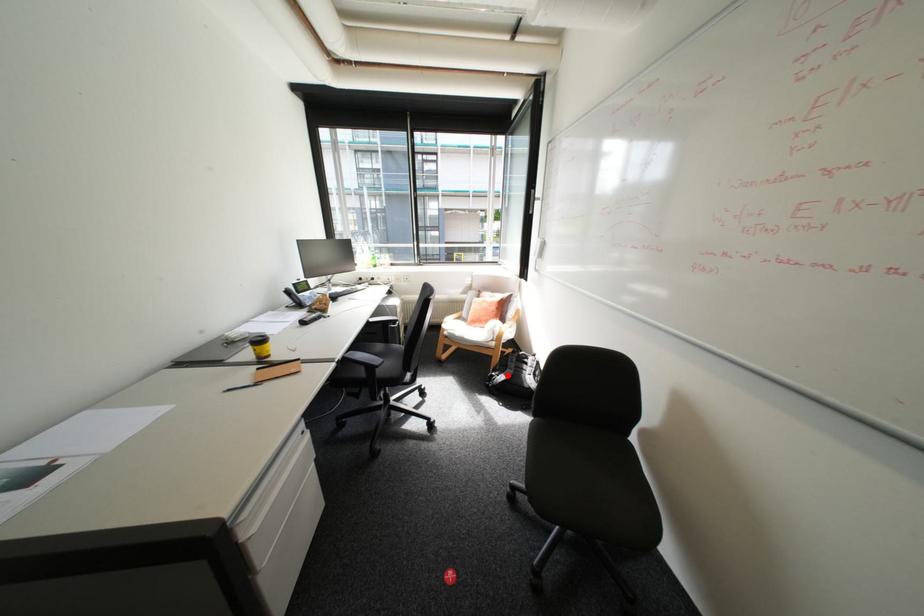
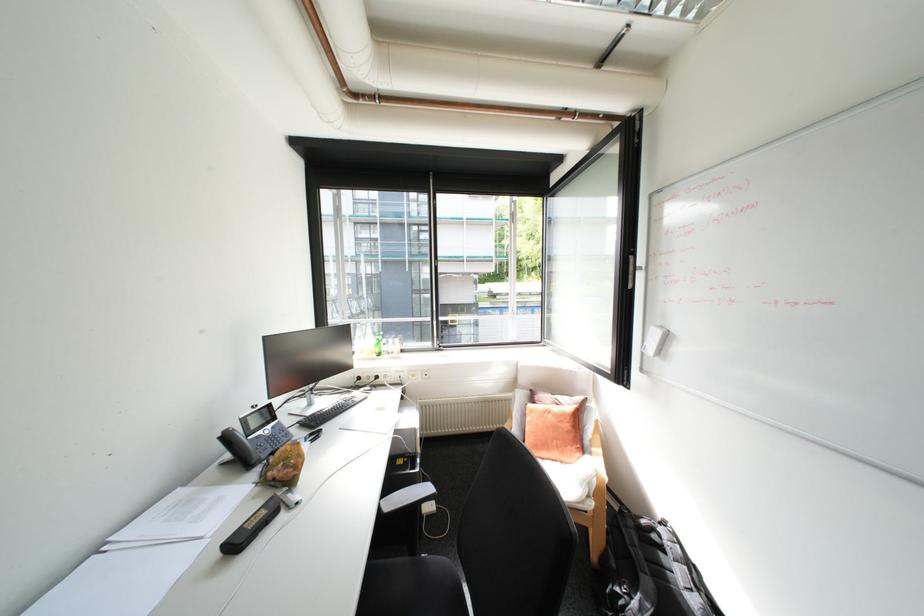
Question: I am providing you with two images of the same scene from different viewpoints. Given a red point in image1, look at the same physical point in image2. Is it:

Choices:
 (A) Closer to the viewpoint
 (B) Farther from the viewpoint

Answer: (A)